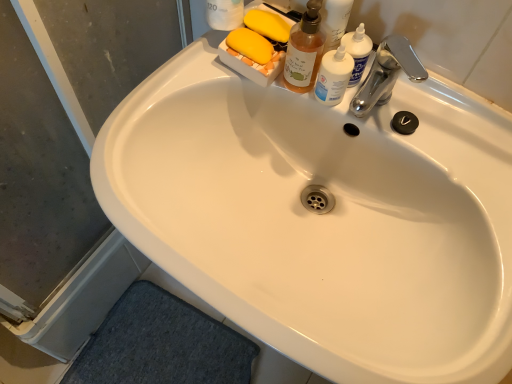
Locate an element on the screen. free space to the right of chrome metallic faucet at upper right is located at coordinates (452, 132).